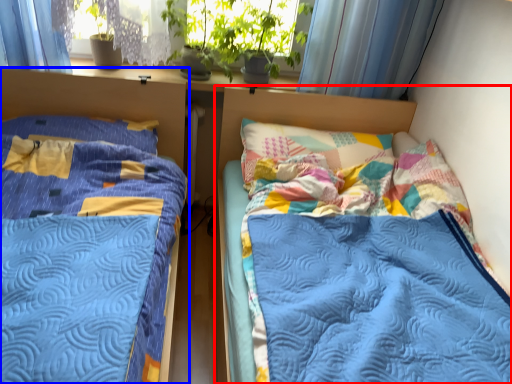
Question: Which of the following is the closest to the observer, bed (highlighted by a red box) or bed (highlighted by a blue box)?

Choices:
 (A) bed
 (B) bed

Answer: (B)